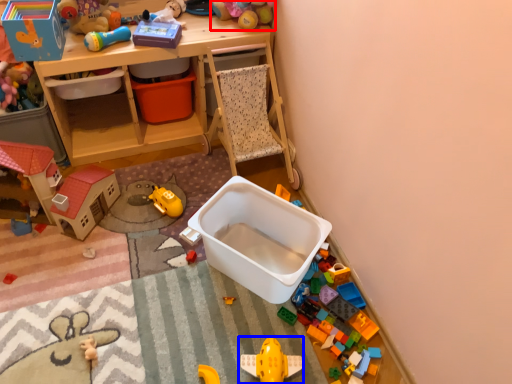
Question: Which of the following is the closest to the observer, toy (highlighted by a red box) or toy (highlighted by a blue box)?

Choices:
 (A) toy
 (B) toy

Answer: (B)